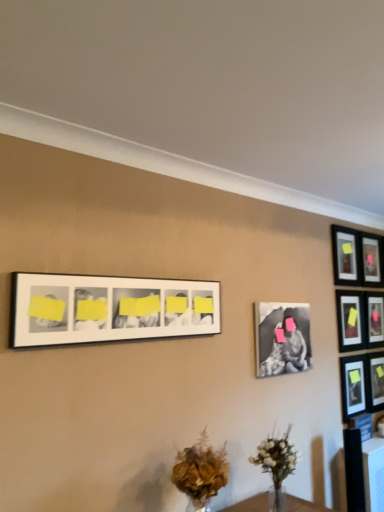
Question: From their relative heights in the image, would you say white matte vase at lower center is taller or shorter than pink matte picture frame at upper right, the second picture frame positioned from the right?

Choices:
 (A) short
 (B) tall

Answer: (A)

Question: From the image's perspective, relative to pink matte picture frame at upper right, the second picture frame positioned from the right, is white matte vase at lower center above or below?

Choices:
 (A) below
 (B) above

Answer: (A)

Question: Estimate the real-world distances between objects in this image. Which object is closer to the pink matte picture frame at upper right, the second picture frame positioned from the right?

Choices:
 (A) white matte vase at lower center
 (B) matte black picture frame at right, which is counted as the 5th picture frame, starting from the left
 (C) matte black picture frame at upper right, the sixth picture frame positioned from the right
 (D) brown textured bouquet at lower center
 (E) white matte picture frame at upper center, which is the 1th picture frame in left-to-right order

Answer: (C)

Question: Which of these objects is positioned closest to the matte black picture frame at upper right, the fourth picture frame in the left-to-right sequence?

Choices:
 (A) white matte vase at lower center
 (B) brown textured bouquet at lower center
 (C) pink matte picture frame at upper right, which is counted as the seventh picture frame, starting from the left
 (D) matte black picture frame at right, which is counted as the 5th picture frame, starting from the left
 (E) matte black picture frame at upper right, the 6th picture frame when ordered from left to right

Answer: (C)